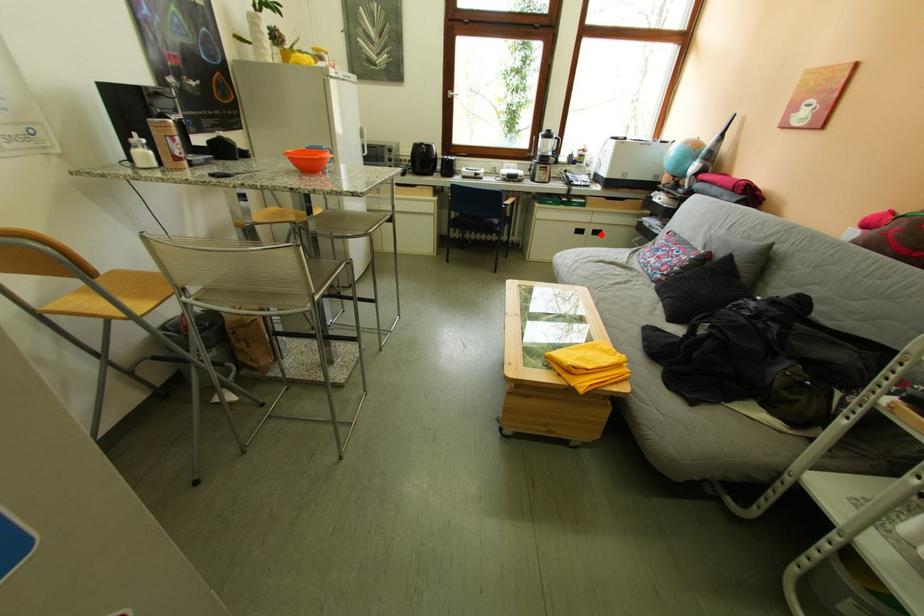
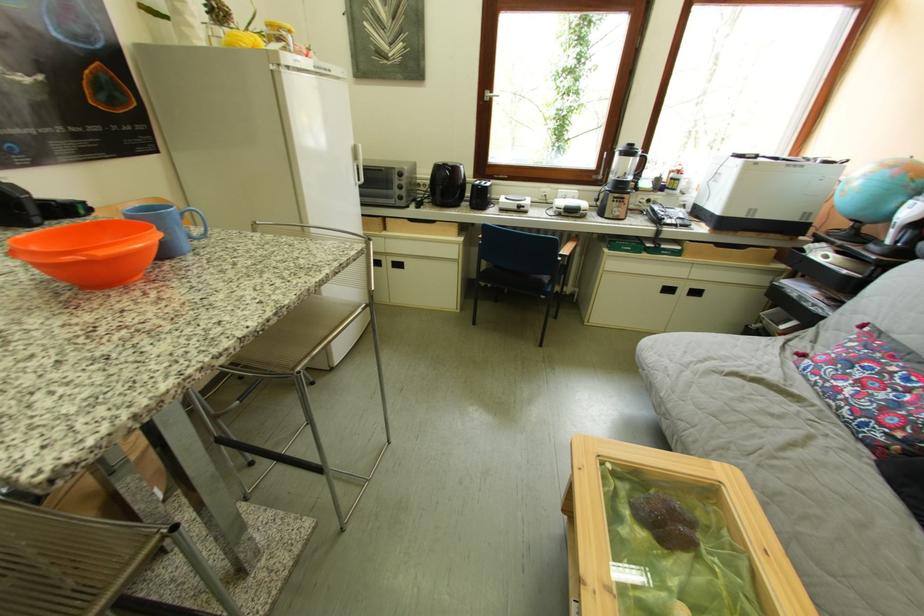
The point at the highlighted location is marked in the first image. Where is the corresponding point in the second image?

(695, 294)